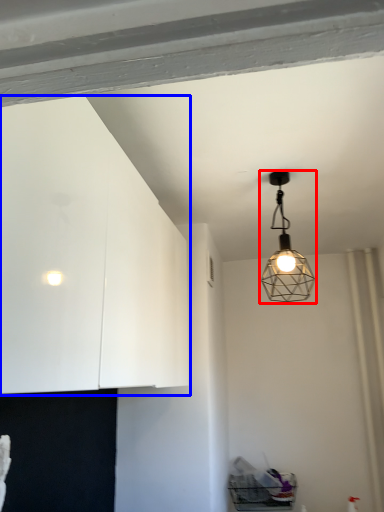
Question: Which object appears closest to the camera in this image, lamp (highlighted by a red box) or dresser (highlighted by a blue box)?

Choices:
 (A) lamp
 (B) dresser

Answer: (B)